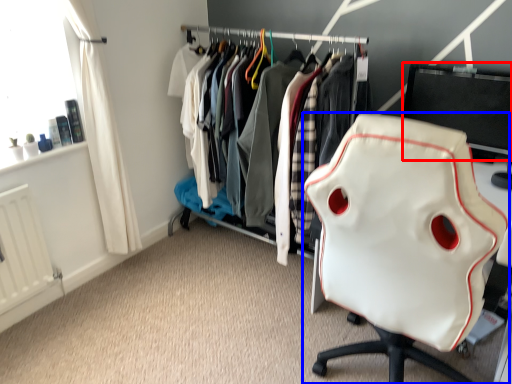
Question: Which object appears closest to the camera in this image, desktop (highlighted by a red box) or chair (highlighted by a blue box)?

Choices:
 (A) desktop
 (B) chair

Answer: (B)